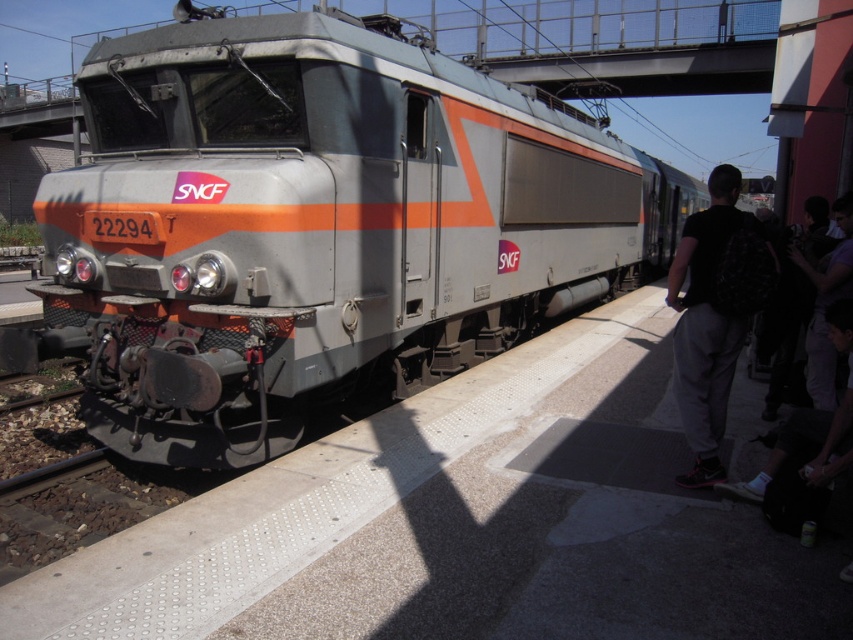
Does metallic gray train at center have a lesser width compared to dark purple shirt at right?

Incorrect, metallic gray train at center's width is not less than dark purple shirt at right's.

Who is higher up, metallic gray train at center or dark purple shirt at right?

metallic gray train at center is above.

Describe the element at coordinates (321, 225) in the screenshot. I see `metallic gray train at center` at that location.

This screenshot has width=853, height=640. Find the location of `metallic gray train at center`. metallic gray train at center is located at coordinates (321, 225).

From the picture: Which is above, dark gray sweatpants at right or dark purple shirt at right?

dark gray sweatpants at right is higher up.

Is dark gray sweatpants at right further to the viewer compared to dark purple shirt at right?

No.

What do you see at coordinates (714, 314) in the screenshot? The height and width of the screenshot is (640, 853). I see `dark gray sweatpants at right` at bounding box center [714, 314].

Find the location of `dark gray sweatpants at right`. dark gray sweatpants at right is located at coordinates (714, 314).

Is metallic gray train at center wider than dark gray sweatpants at right?

Correct, the width of metallic gray train at center exceeds that of dark gray sweatpants at right.

Who is more forward, [511,234] or [733,304]?

Point [733,304] is more forward.

I want to click on metallic gray train at center, so (x=321, y=225).